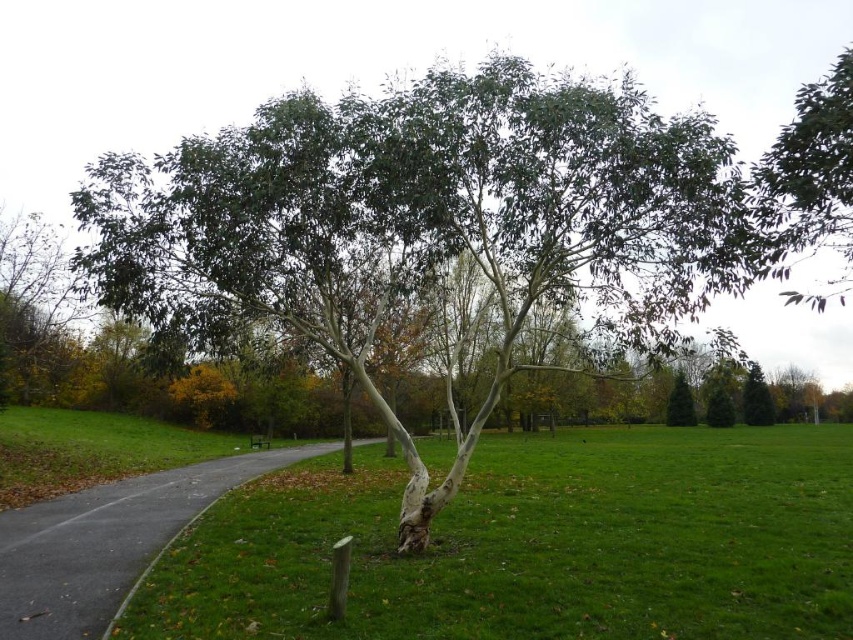
You are standing in the park and want to take a photo of the green matte tree at center. If your camera can focus on objects up to 5 meters away, will you need to move closer or farther away to ensure the tree is in focus?

The green matte tree at center is 4.33 meters away from the viewer. Since the camera can focus up to 5 meters, you do not need to move closer or farther away. The tree is within the camera focus range.

You are a landscape architect designing a new park layout. You need to ensure that the green matte tree at center does not overshadow the gray asphalt path at center. Based on the scene description, what adjustment could you make to the tree to maintain visibility of the path?

The green matte tree at center is taller than the gray asphalt path at center. To prevent overshadowing, you could prune the tree to reduce its height or strategically position it so its canopy does not block sunlight from reaching the path.

You are a gardener who needs to water the green grassy at center and the gray asphalt path at center. Which one is closer to you?

The green grassy at center and the gray asphalt path at center are both at center, so they are equidistant from you.